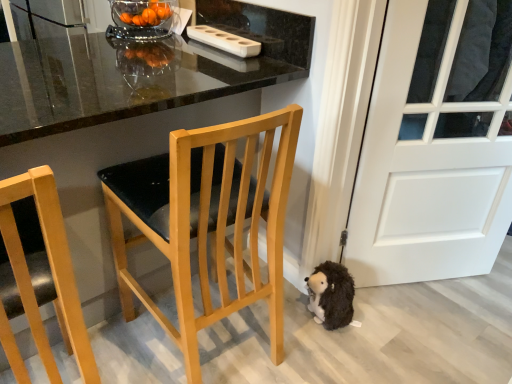
Question: Which is correct: light wood chair at center, the first chair in the right-to-left sequence, is inside transparent glass bowl at upper center, or outside of it?

Choices:
 (A) outside
 (B) inside

Answer: (A)

Question: In terms of width, does light wood chair at center, placed as the second chair when sorted from left to right, look wider or thinner when compared to transparent glass bowl at upper center?

Choices:
 (A) wide
 (B) thin

Answer: (A)

Question: Which is nearer to the light wood chair at center, the first chair in the right-to-left sequence?

Choices:
 (A) transparent glass bowl at upper center
 (B) white plastic container at upper center
 (C) fluffy brown plush hedgehog at lower right
 (D) light wood chair at left, marked as the first chair in a left-to-right arrangement
 (E) glossy black table at center

Answer: (D)

Question: Estimate the real-world distances between objects in this image. Which object is closer to the transparent glass bowl at upper center?

Choices:
 (A) glossy black table at center
 (B) light wood chair at left, marked as the first chair in a left-to-right arrangement
 (C) white matte door at lower right
 (D) fluffy brown plush hedgehog at lower right
 (E) white plastic container at upper center

Answer: (E)